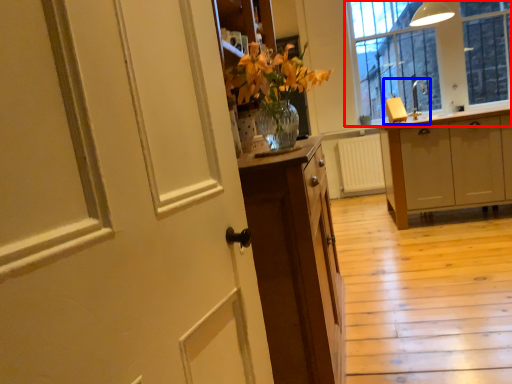
Question: Which object appears farthest to the camera in this image, window (highlighted by a red box) or sink (highlighted by a blue box)?

Choices:
 (A) window
 (B) sink

Answer: (A)